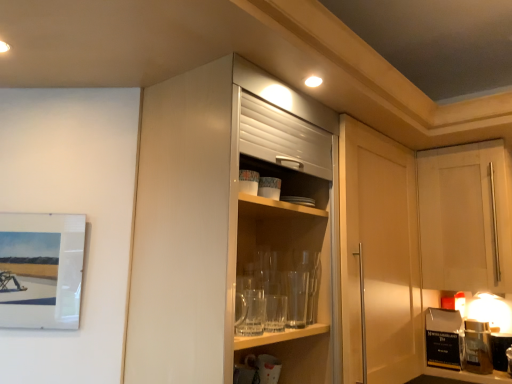
Question: Would you say glossy white cabinet at center, acting as the second cabinetry starting from the right, is outside matte white picture frame at left?

Choices:
 (A) yes
 (B) no

Answer: (A)

Question: Considering the relative sizes of glossy white cabinet at center, which ranks as the first cabinetry in front-to-back order, and matte white picture frame at left in the image provided, is glossy white cabinet at center, which ranks as the first cabinetry in front-to-back order, shorter than matte white picture frame at left?

Choices:
 (A) yes
 (B) no

Answer: (B)

Question: Is glossy white cabinet at center, acting as the second cabinetry starting from the right, smaller than matte white picture frame at left?

Choices:
 (A) yes
 (B) no

Answer: (B)

Question: Does glossy white cabinet at center, acting as the second cabinetry starting from the right, have a larger size compared to matte white picture frame at left?

Choices:
 (A) no
 (B) yes

Answer: (B)

Question: Is glossy white cabinet at center, the 1th cabinetry positioned from the left, at the left side of matte white picture frame at left?

Choices:
 (A) no
 (B) yes

Answer: (A)

Question: Considering the relative positions of glossy white cabinet at center, the second cabinetry in the back-to-front sequence, and matte white picture frame at left in the image provided, is glossy white cabinet at center, the second cabinetry in the back-to-front sequence, to the right of matte white picture frame at left from the viewer's perspective?

Choices:
 (A) no
 (B) yes

Answer: (B)

Question: From a real-world perspective, is matte white picture frame at left beneath white matte cabinet at upper right, acting as the 2th cabinetry starting from the front?

Choices:
 (A) no
 (B) yes

Answer: (B)

Question: Considering the relative sizes of matte white picture frame at left and white matte cabinet at upper right, the second cabinetry from the left, in the image provided, is matte white picture frame at left wider than white matte cabinet at upper right, the second cabinetry from the left,?

Choices:
 (A) no
 (B) yes

Answer: (A)

Question: Would you consider matte white picture frame at left to be distant from white matte cabinet at upper right, which appears as the first cabinetry when viewed from the right?

Choices:
 (A) no
 (B) yes

Answer: (B)

Question: Is matte white picture frame at left positioned behind white matte cabinet at upper right, which appears as the first cabinetry when viewed from the right?

Choices:
 (A) yes
 (B) no

Answer: (B)

Question: Considering the relative sizes of matte white picture frame at left and white matte cabinet at upper right, the first cabinetry viewed from the back, in the image provided, is matte white picture frame at left taller than white matte cabinet at upper right, the first cabinetry viewed from the back,?

Choices:
 (A) no
 (B) yes

Answer: (A)

Question: Does matte white picture frame at left appear on the right side of white matte cabinet at upper right, acting as the 2th cabinetry starting from the front?

Choices:
 (A) yes
 (B) no

Answer: (B)

Question: Does glossy white cabinet at center, which ranks as the first cabinetry in front-to-back order, turn towards white matte cabinet at upper right, acting as the 2th cabinetry starting from the front?

Choices:
 (A) no
 (B) yes

Answer: (A)